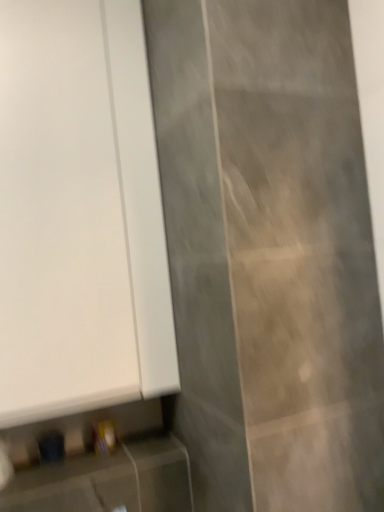
Question: Considering the relative sizes of white matte door at upper left and matte white cabinet at lower left in the image provided, is white matte door at upper left wider than matte white cabinet at lower left?

Choices:
 (A) yes
 (B) no

Answer: (B)

Question: Does white matte door at upper left have a lesser height compared to matte white cabinet at lower left?

Choices:
 (A) no
 (B) yes

Answer: (A)

Question: Is white matte door at upper left aimed at matte white cabinet at lower left?

Choices:
 (A) no
 (B) yes

Answer: (A)

Question: From a real-world perspective, does white matte door at upper left sit lower than matte white cabinet at lower left?

Choices:
 (A) yes
 (B) no

Answer: (B)

Question: From a real-world perspective, is white matte door at upper left located higher than matte white cabinet at lower left?

Choices:
 (A) no
 (B) yes

Answer: (B)

Question: Considering the relative sizes of white matte door at upper left and matte white cabinet at lower left in the image provided, is white matte door at upper left smaller than matte white cabinet at lower left?

Choices:
 (A) no
 (B) yes

Answer: (A)

Question: Is the depth of matte white cabinet at lower left greater than that of white matte door at upper left?

Choices:
 (A) yes
 (B) no

Answer: (B)

Question: From the image's perspective, is matte white cabinet at lower left under white matte door at upper left?

Choices:
 (A) no
 (B) yes

Answer: (B)

Question: From the image's perspective, is matte white cabinet at lower left above white matte door at upper left?

Choices:
 (A) no
 (B) yes

Answer: (A)

Question: From a real-world perspective, does matte white cabinet at lower left stand above white matte door at upper left?

Choices:
 (A) yes
 (B) no

Answer: (B)

Question: Is matte white cabinet at lower left outside white matte door at upper left?

Choices:
 (A) yes
 (B) no

Answer: (A)

Question: Considering the relative sizes of matte white cabinet at lower left and white matte door at upper left in the image provided, is matte white cabinet at lower left taller than white matte door at upper left?

Choices:
 (A) yes
 (B) no

Answer: (B)

Question: Looking at the image, does matte white cabinet at lower left seem bigger or smaller compared to white matte door at upper left?

Choices:
 (A) big
 (B) small

Answer: (B)